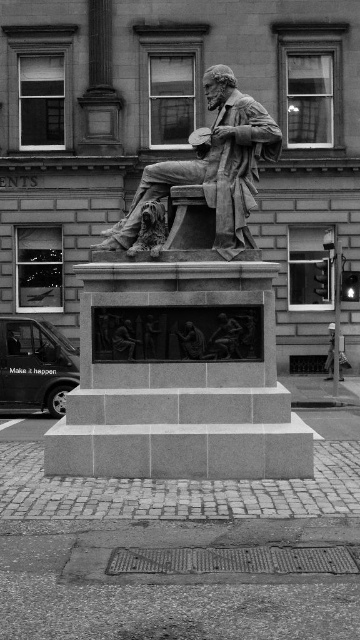
Question: Does bronze statue at center have a smaller size compared to polished bronze statue at center?

Choices:
 (A) no
 (B) yes

Answer: (A)

Question: Which point is closer to the camera?

Choices:
 (A) polished bronze statue at center
 (B) bronze statue at center

Answer: (B)

Question: Which object appears closest to the camera in this image?

Choices:
 (A) polished bronze statue at center
 (B) bronze statue at center

Answer: (B)

Question: Is bronze statue at center thinner than polished bronze statue at center?

Choices:
 (A) yes
 (B) no

Answer: (B)

Question: Can you confirm if bronze statue at center is positioned to the left of polished bronze statue at center?

Choices:
 (A) no
 (B) yes

Answer: (A)